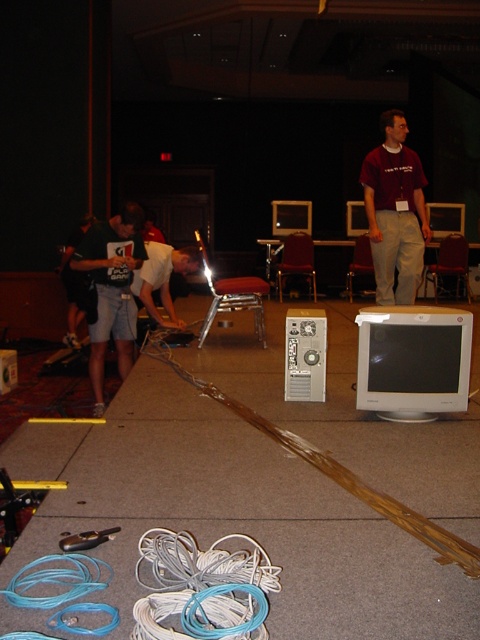
Does dark gray shorts at left come behind white fabric shirt at center?

No, dark gray shorts at left is closer to the viewer.

Which is in front, point (93, 259) or point (172, 310)?

Point (93, 259) is in front.

Identify the location of dark gray shorts at left. This screenshot has height=640, width=480. (111, 289).

Between matte maroon shirt at center and dark gray shorts at left, which one has more height?

matte maroon shirt at center is taller.

Who is more distant from viewer, (373, 260) or (130, 276)?

The point (373, 260) is more distant.

Who is more forward, (376, 186) or (101, 298)?

Point (101, 298) is more forward.

Identify the location of matte maroon shirt at center. (395, 212).

Is white rubber wire at lower center thinner than matte maroon shirt at center?

Yes.

Does point (276, 586) come farther from viewer compared to point (384, 173)?

No, (276, 586) is in front of (384, 173).

You are a GUI agent. You are given a task and a screenshot of the screen. Output one action in this format:
    pyautogui.click(x=<x>, y=<y>)
    Task: Click on the white rubber wire at lower center
    The image size is (480, 640).
    Given the screenshot: What is the action you would take?
    [x=203, y=588]